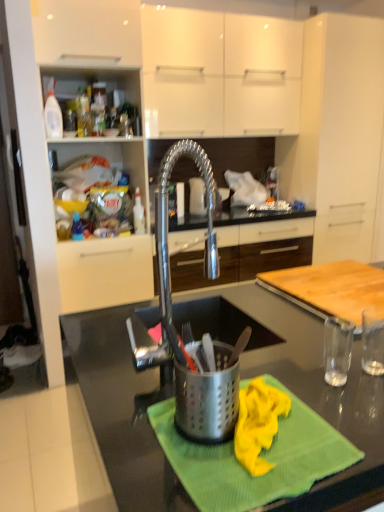
Locate an element on the screen. free location to the right of polished stainless steel faucet at center is located at coordinates (279, 353).